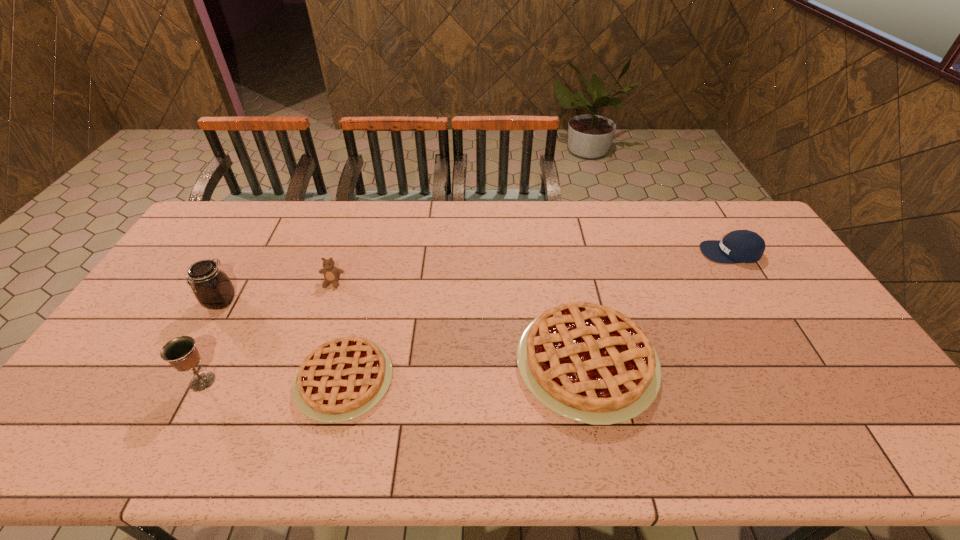
You are a GUI agent. You are given a task and a screenshot of the screen. Output one action in this format:
    pyautogui.click(x=<x>, y=<y>)
    Task: Click on the vacant area at the left edge of the desktop
    
    Given the screenshot: What is the action you would take?
    pyautogui.click(x=129, y=328)

The width and height of the screenshot is (960, 540). Identify the location of vacant space at the far left corner of the desktop. (250, 220).

At what (x,y) coordinates should I click in order to perform the action: click on vacant area at the near right corner. Please return your answer as a coordinate pair (x, y). Image resolution: width=960 pixels, height=540 pixels. Looking at the image, I should click on (819, 389).

The image size is (960, 540). Find the location of `blank region between the baseball cap and the jar`. blank region between the baseball cap and the jar is located at coordinates (476, 277).

This screenshot has width=960, height=540. In order to click on vacant area that lies between the shortest object and the teddy bear in this screenshot , I will do `click(339, 332)`.

The height and width of the screenshot is (540, 960). I want to click on empty space that is in between the shorter pie and the chalice, so (274, 381).

Find the location of a particular element. Image resolution: width=960 pixels, height=540 pixels. vacant space in between the chalice and the jar is located at coordinates (212, 342).

The image size is (960, 540). Identify the location of vacant space in between the chalice and the farthest object. pyautogui.click(x=467, y=317).

Identify the location of blank region between the fifth nearest object and the fifth object from left to right. (460, 323).

Where is `free point between the second farthest object and the chalice`? free point between the second farthest object and the chalice is located at coordinates (268, 332).